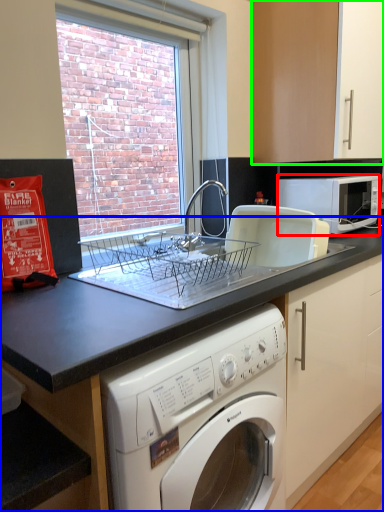
Question: Based on their relative distances, which object is farther from microwave oven (highlighted by a red box)? Choose from countertop (highlighted by a blue box) and cabinetry (highlighted by a green box).

Choices:
 (A) countertop
 (B) cabinetry

Answer: (A)